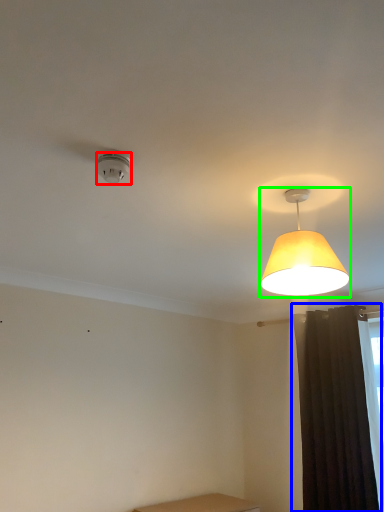
Question: Which is nearer to the lamp (highlighted by a red box)? curtain (highlighted by a blue box) or lamp (highlighted by a green box).

Choices:
 (A) curtain
 (B) lamp

Answer: (B)